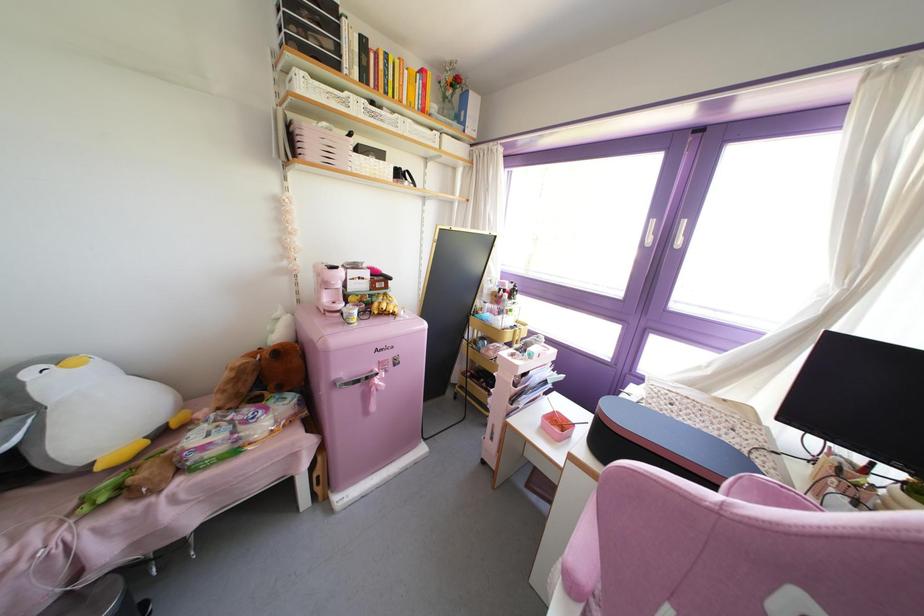
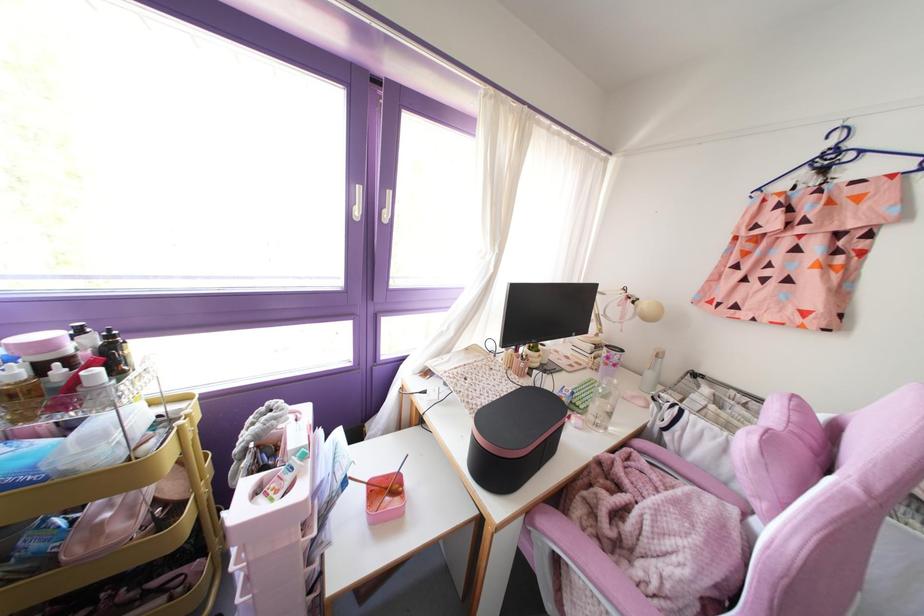
Locate, in the second image, the point that corresponds to point (508, 297) in the first image.

(116, 373)